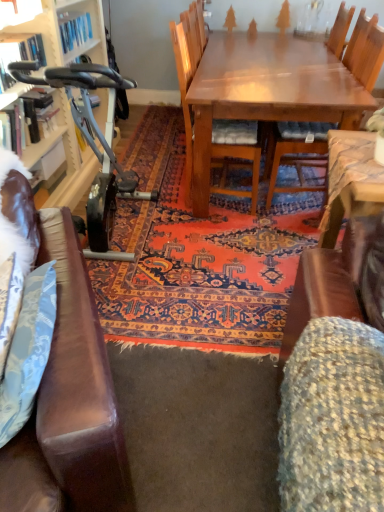
This screenshot has height=512, width=384. Find the location of `vacant area that is in front of wooden chair at center, which is the second chair from right to left`. vacant area that is in front of wooden chair at center, which is the second chair from right to left is located at coordinates (221, 228).